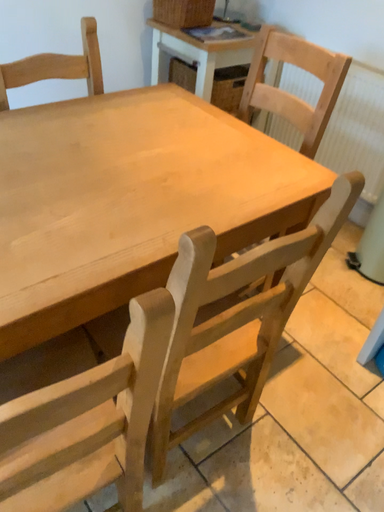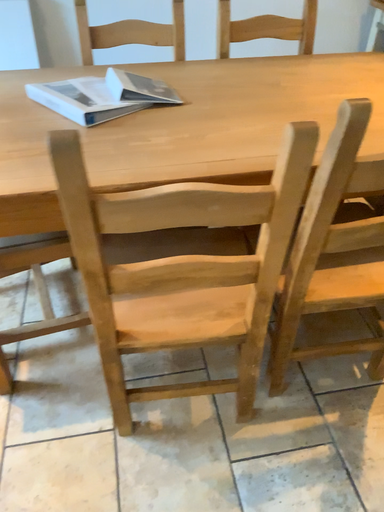
Question: Which way did the camera rotate in the video?

Choices:
 (A) rotated left
 (B) rotated right

Answer: (A)